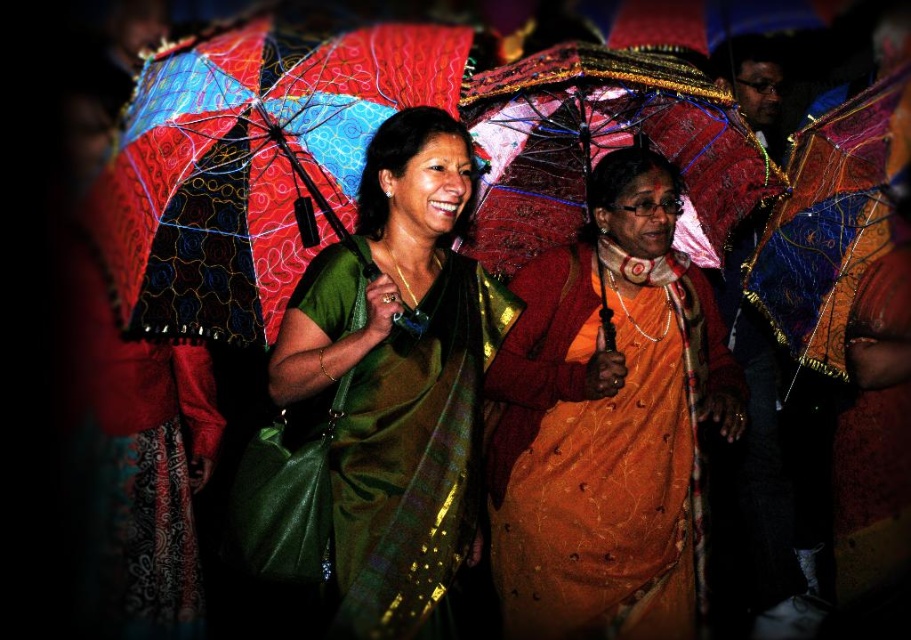
You are standing at the origin point of the coordinate system in the image. You want to move towards the multicolored fabric umbrella at upper left. What direction should you move in?

Since the multicolored fabric umbrella at upper left is located at point (251, 161) in the coordinate system, you should move northeast to reach it.

You are a photographer trying to capture a closeup of the multicolored fabric umbrella at upper left without the multicolored fabric umbrella at upper right blocking the view. Based on the scene description, can you fit the shot without moving the umbrellas?

The multicolored fabric umbrella at upper left is bigger than the multicolored fabric umbrella at upper right, so it might block the smaller one. To capture a closeup of the multicolored fabric umbrella at upper left without obstruction, you would need to position the camera so that the larger umbrella is centered and the smaller one is out of frame or adjust the angle to avoid overlap.

You are a photographer trying to capture a closeup shot of the orange silk saree at center and the multicolored fabric umbrella at upper right. Since you want to focus on the details of the saree, which object should you zoom in on first and why?

The orange silk saree at center is larger in size than the multicolored fabric umbrella at upper right, so you should zoom in on the orange silk saree at center first because it occupies more space in the frame, making it easier to capture detailed features without losing clarity.